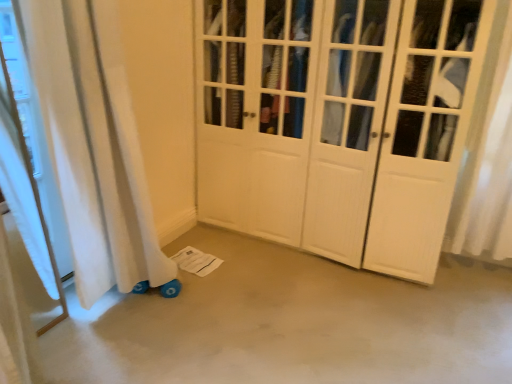
Question: Is smooth concrete floor at lower center located outside white wood wardrobe at center?

Choices:
 (A) no
 (B) yes

Answer: (B)

Question: From a real-world perspective, is smooth concrete floor at lower center below white wood wardrobe at center?

Choices:
 (A) yes
 (B) no

Answer: (A)

Question: Does smooth concrete floor at lower center have a lesser height compared to white wood wardrobe at center?

Choices:
 (A) no
 (B) yes

Answer: (B)

Question: Considering the relative sizes of smooth concrete floor at lower center and white wood wardrobe at center in the image provided, is smooth concrete floor at lower center bigger than white wood wardrobe at center?

Choices:
 (A) yes
 (B) no

Answer: (B)

Question: From the image's perspective, is smooth concrete floor at lower center located above white wood wardrobe at center?

Choices:
 (A) no
 (B) yes

Answer: (A)

Question: Does smooth concrete floor at lower center have a greater width compared to white wood wardrobe at center?

Choices:
 (A) yes
 (B) no

Answer: (A)

Question: From a real-world perspective, is white wood wardrobe at center over smooth concrete floor at lower center?

Choices:
 (A) yes
 (B) no

Answer: (A)

Question: Is white wood wardrobe at center completely or partially outside of smooth concrete floor at lower center?

Choices:
 (A) no
 (B) yes

Answer: (B)

Question: Is white wood wardrobe at center closer to the viewer compared to smooth concrete floor at lower center?

Choices:
 (A) yes
 (B) no

Answer: (B)

Question: Can you confirm if white wood wardrobe at center is wider than smooth concrete floor at lower center?

Choices:
 (A) no
 (B) yes

Answer: (A)

Question: Is white wood wardrobe at center to the left of smooth concrete floor at lower center from the viewer's perspective?

Choices:
 (A) yes
 (B) no

Answer: (B)

Question: Is white wood wardrobe at center facing towards smooth concrete floor at lower center?

Choices:
 (A) no
 (B) yes

Answer: (B)

Question: Is smooth concrete floor at lower center spatially inside white wood wardrobe at center, or outside of it?

Choices:
 (A) outside
 (B) inside

Answer: (A)